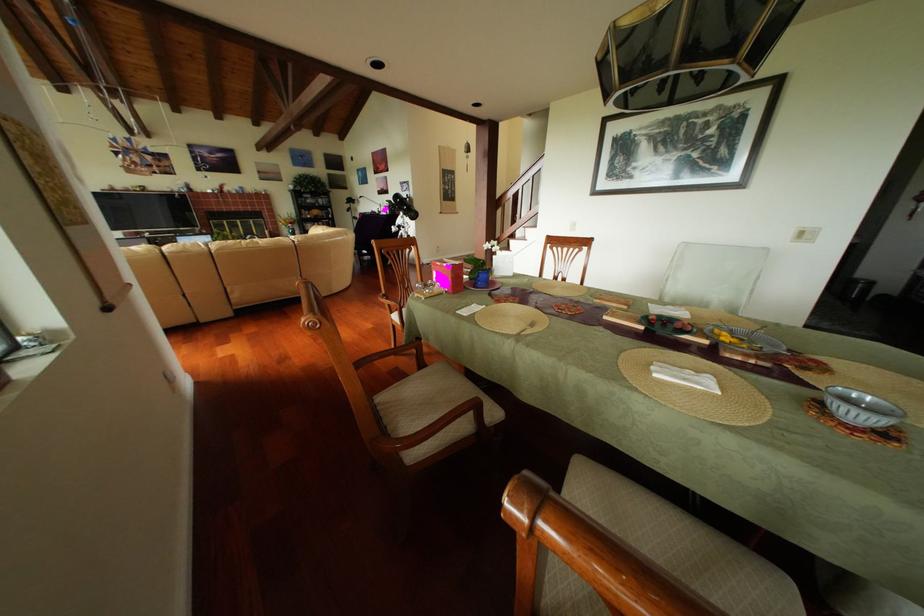
Describe the element at coordinates (805, 235) in the screenshot. The height and width of the screenshot is (616, 924). I see `the white light switch` at that location.